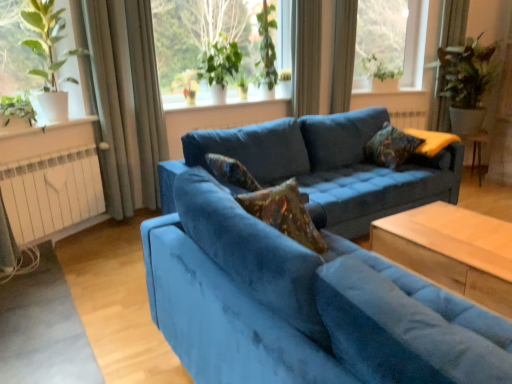
Question: Is green leafy plant at left, the fifth plant positioned from the right, taller or shorter than green leafy plant at upper center, which appears as the 3th plant when viewed from the right?

Choices:
 (A) short
 (B) tall

Answer: (A)

Question: Considering the relative positions of green leafy plant at left, the first plant from the left, and green leafy plant at upper center, which appears as the 3th plant when viewed from the right, in the image provided, is green leafy plant at left, the first plant from the left, to the left or to the right of green leafy plant at upper center, which appears as the 3th plant when viewed from the right,?

Choices:
 (A) right
 (B) left

Answer: (B)

Question: Estimate the real-world distances between objects in this image. Which object is farther from the green leafy plant at upper center, which appears as the 3th plant when viewed from the right?

Choices:
 (A) satin curtain at upper center, the third curtain positioned from the left
 (B) transparent glass window at upper right, the first window from the right
 (C) white ceramic window sill at center, acting as the second window sill starting from the front
 (D) satin curtain at upper center, the first curtain when ordered from right to left
 (E) white metallic radiator at lower left

Answer: (B)

Question: Which of these objects is positioned farthest from the green leafy plant at upper center, which is counted as the 4th plant, starting from the left?

Choices:
 (A) white ceramic window sill at upper left, placed as the 2th window sill when sorted from top to bottom
 (B) white metallic radiator at lower left
 (C) green leafy plant at upper center, the fourth plant in the right-to-left sequence
 (D) satin curtain at upper center, the third curtain positioned from the left
 (E) green leafy plant at left, the fifth plant positioned from the right

Answer: (E)